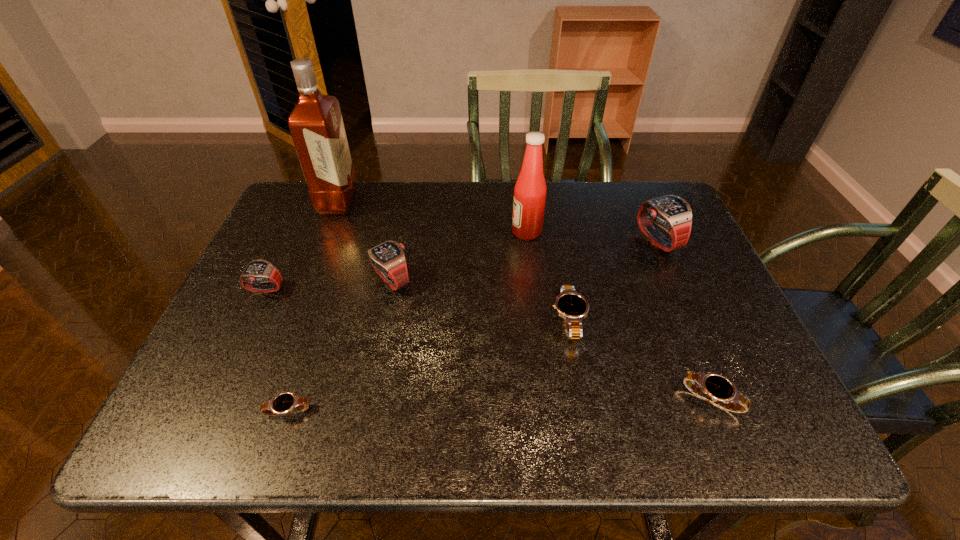
At what (x,y) coordinates should I click in order to perform the action: click on free space between the second watch from left to right and the fourth tallest object. Please return your answer as a coordinate pair (x, y). Looking at the image, I should click on (340, 345).

Identify the location of free space between the second tallest object and the shortest object. The height and width of the screenshot is (540, 960). (407, 321).

At what (x,y) coordinates should I click in order to perform the action: click on vacant space in between the smallest red watch and the biggest red watch. Please return your answer as a coordinate pair (x, y). The image size is (960, 540). Looking at the image, I should click on (461, 266).

What are the coordinates of `unoccupied position between the fourth tallest watch and the red condiment` in the screenshot? It's located at [547, 276].

What are the coordinates of `free space between the sixth tallest object and the red condiment` in the screenshot? It's located at (547, 276).

Locate an element on the screen. The height and width of the screenshot is (540, 960). free space between the condiment and the fourth tallest watch is located at coordinates (547, 276).

Where is `free area in between the shortest object and the sixth shortest object`? The height and width of the screenshot is (540, 960). free area in between the shortest object and the sixth shortest object is located at coordinates (472, 326).

At what (x,y) coordinates should I click in order to perform the action: click on unoccupied area between the second watch from left to right and the rightmost red watch. Please return your answer as a coordinate pair (x, y). Image resolution: width=960 pixels, height=540 pixels. Looking at the image, I should click on (472, 326).

Locate an element on the screen. the second closest object to the fifth object from right to left is located at coordinates (316, 125).

Locate an element on the screen. the third closest object to the leftmost red watch is located at coordinates (284, 403).